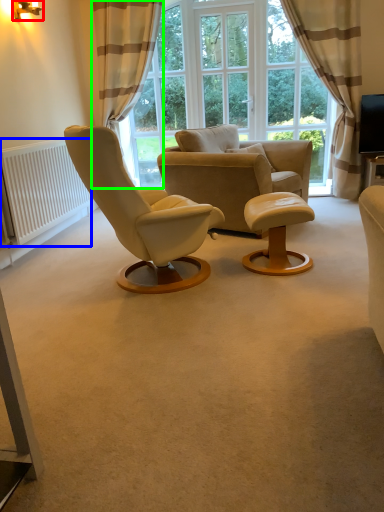
Question: Based on their relative distances, which object is farther from lamp (highlighted by a red box)? Choose from radiator (highlighted by a blue box) and curtain (highlighted by a green box).

Choices:
 (A) radiator
 (B) curtain

Answer: (A)